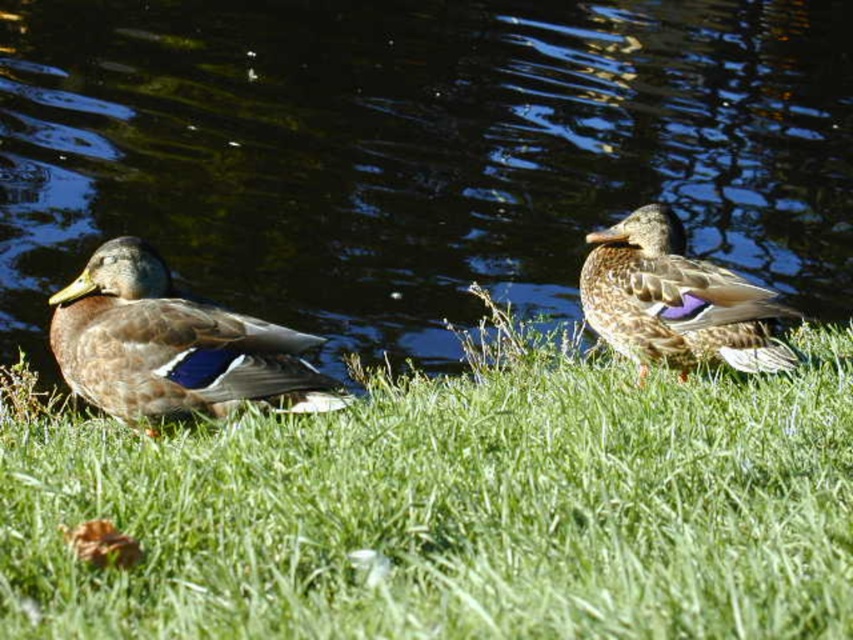
Does green grassy at lower center appear on the left side of brown feathered duck at center?

Indeed, green grassy at lower center is positioned on the left side of brown feathered duck at center.

Identify the location of green grassy at lower center. (457, 509).

Measure the distance between point (523, 376) and camera.

The distance of point (523, 376) from camera is 6.40 meters.

Identify the location of green grassy at lower center. The image size is (853, 640). (457, 509).

From the picture: Is dark reflective water at center to the left of brown matte duck at left from the viewer's perspective?

Incorrect, dark reflective water at center is not on the left side of brown matte duck at left.

This screenshot has width=853, height=640. What do you see at coordinates (416, 150) in the screenshot?
I see `dark reflective water at center` at bounding box center [416, 150].

Where is `dark reflective water at center`? Image resolution: width=853 pixels, height=640 pixels. dark reflective water at center is located at coordinates (416, 150).

Is brown matte duck at left thinner than brown feathered duck at center?

Incorrect, brown matte duck at left's width is not less than brown feathered duck at center's.

At what (x,y) coordinates should I click in order to perform the action: click on brown matte duck at left. Please return your answer as a coordinate pair (x, y). The height and width of the screenshot is (640, 853). Looking at the image, I should click on (172, 346).